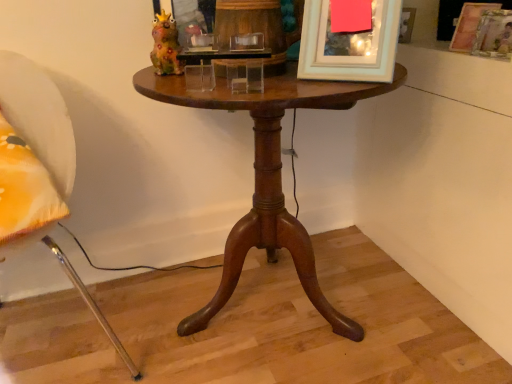
Question: Is wooden picture frame at upper right, which is counted as the first picture frame, starting from the right, taller than mahogany wood table at center?

Choices:
 (A) yes
 (B) no

Answer: (B)

Question: Is wooden picture frame at upper right, arranged as the 3th picture frame when viewed from the left, positioned before mahogany wood table at center?

Choices:
 (A) no
 (B) yes

Answer: (A)

Question: Is mahogany wood table at center surrounded by wooden picture frame at upper right, the 2th picture frame from the back?

Choices:
 (A) yes
 (B) no

Answer: (B)

Question: Can you confirm if wooden picture frame at upper right, arranged as the 3th picture frame when viewed from the left, is bigger than mahogany wood table at center?

Choices:
 (A) no
 (B) yes

Answer: (A)

Question: From the image's perspective, is wooden picture frame at upper right, the 2th picture frame from the back, located beneath mahogany wood table at center?

Choices:
 (A) no
 (B) yes

Answer: (A)

Question: Considering the relative sizes of wooden picture frame at upper right, the 2th picture frame from the back, and mahogany wood table at center in the image provided, is wooden picture frame at upper right, the 2th picture frame from the back, thinner than mahogany wood table at center?

Choices:
 (A) no
 (B) yes

Answer: (B)

Question: Considering the relative sizes of white matte picture frame at upper center, positioned as the 3th picture frame in back-to-front order, and mahogany wood table at center in the image provided, is white matte picture frame at upper center, positioned as the 3th picture frame in back-to-front order, thinner than mahogany wood table at center?

Choices:
 (A) no
 (B) yes

Answer: (B)

Question: Considering the relative positions of white matte picture frame at upper center, positioned as the 3th picture frame in back-to-front order, and mahogany wood table at center in the image provided, is white matte picture frame at upper center, positioned as the 3th picture frame in back-to-front order, behind mahogany wood table at center?

Choices:
 (A) no
 (B) yes

Answer: (B)

Question: Is the position of white matte picture frame at upper center, the 1th picture frame viewed from the front, less distant than that of mahogany wood table at center?

Choices:
 (A) no
 (B) yes

Answer: (A)

Question: Is white matte picture frame at upper center, acting as the 3th picture frame starting from the right, smaller than mahogany wood table at center?

Choices:
 (A) no
 (B) yes

Answer: (B)

Question: Can you confirm if white matte picture frame at upper center, the first picture frame viewed from the left, is bigger than mahogany wood table at center?

Choices:
 (A) yes
 (B) no

Answer: (B)

Question: Can you confirm if white matte picture frame at upper center, the first picture frame viewed from the left, is positioned to the right of mahogany wood table at center?

Choices:
 (A) no
 (B) yes

Answer: (B)

Question: Is white matte picture frame at upper center, positioned as the 3th picture frame in back-to-front order, at the right side of wooden picture frame at upper right, the 2th picture frame from the back?

Choices:
 (A) no
 (B) yes

Answer: (A)